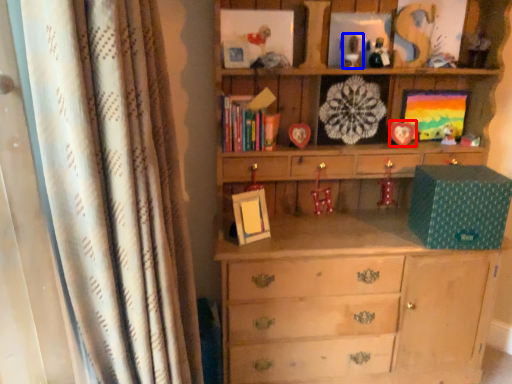
Question: Which of the following is the closest to the observer, picture frame (highlighted by a red box) or toy (highlighted by a blue box)?

Choices:
 (A) picture frame
 (B) toy

Answer: (B)